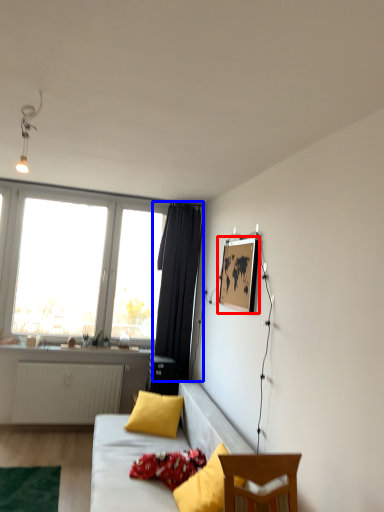
Question: Among these objects, which one is farthest to the camera, picture frame (highlighted by a red box) or curtain (highlighted by a blue box)?

Choices:
 (A) picture frame
 (B) curtain

Answer: (B)